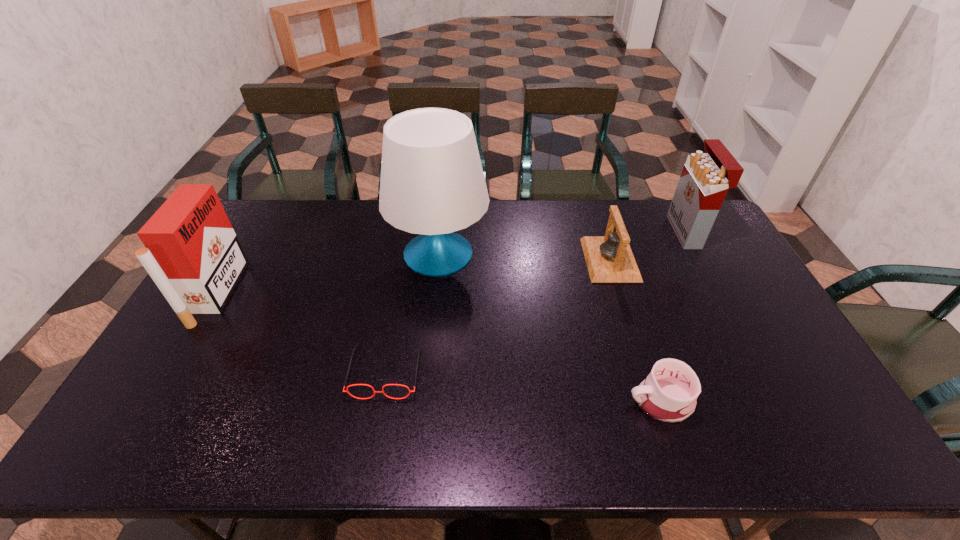
The width and height of the screenshot is (960, 540). I want to click on vacant area at the near right corner of the desktop, so click(x=829, y=449).

The width and height of the screenshot is (960, 540). I want to click on vacant area that lies between the right cigarette case and the tallest object, so click(x=563, y=242).

This screenshot has height=540, width=960. Identify the location of vacant area that lies between the farther cigarette case and the second shortest object. (673, 316).

The height and width of the screenshot is (540, 960). What are the coordinates of `unoccupied area between the shortest object and the bell` in the screenshot? It's located at (498, 315).

Where is `free area in between the mug and the fourth tallest object`? The height and width of the screenshot is (540, 960). free area in between the mug and the fourth tallest object is located at coordinates (635, 330).

The width and height of the screenshot is (960, 540). Find the location of `vacant space that is in between the fourth tallest object and the shortest object`. vacant space that is in between the fourth tallest object and the shortest object is located at coordinates (x=498, y=315).

You are a GUI agent. You are given a task and a screenshot of the screen. Output one action in this format:
    pyautogui.click(x=<x>, y=<y>)
    Task: Click on the free space that is in between the shortest object and the right cigarette case
    
    Given the screenshot: What is the action you would take?
    pyautogui.click(x=537, y=301)

I want to click on vacant area that lies between the tallest object and the right cigarette case, so click(563, 242).

The width and height of the screenshot is (960, 540). In order to click on blank region between the spectacles and the farther cigarette case in this screenshot , I will do `click(537, 301)`.

Find the location of a particular element. The width and height of the screenshot is (960, 540). free space between the mug and the spectacles is located at coordinates (523, 386).